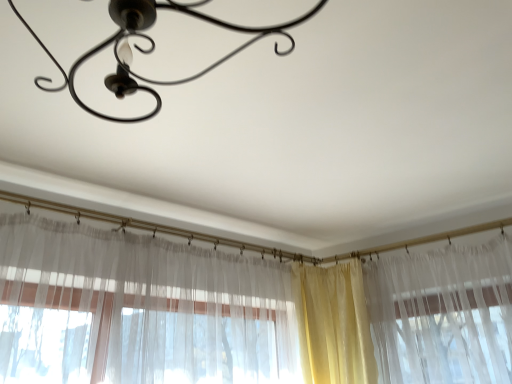
Question: Does metallic chandelier at upper center come in front of yellow sheer curtain at center?

Choices:
 (A) no
 (B) yes

Answer: (B)

Question: Is the position of metallic chandelier at upper center more distant than that of yellow sheer curtain at center?

Choices:
 (A) yes
 (B) no

Answer: (B)

Question: Does metallic chandelier at upper center have a lesser width compared to yellow sheer curtain at center?

Choices:
 (A) yes
 (B) no

Answer: (B)

Question: Can you confirm if metallic chandelier at upper center is shorter than yellow sheer curtain at center?

Choices:
 (A) yes
 (B) no

Answer: (A)

Question: Could yellow sheer curtain at center be considered to be inside metallic chandelier at upper center?

Choices:
 (A) no
 (B) yes

Answer: (A)

Question: From a real-world perspective, is metallic chandelier at upper center positioned over yellow sheer curtain at center based on gravity?

Choices:
 (A) no
 (B) yes

Answer: (B)

Question: Does yellow sheer curtain at center appear on the right side of metallic chandelier at upper center?

Choices:
 (A) yes
 (B) no

Answer: (A)

Question: Can you confirm if yellow sheer curtain at center is bigger than metallic chandelier at upper center?

Choices:
 (A) no
 (B) yes

Answer: (A)

Question: Is yellow sheer curtain at center closer to camera compared to metallic chandelier at upper center?

Choices:
 (A) yes
 (B) no

Answer: (B)

Question: Does yellow sheer curtain at center come behind metallic chandelier at upper center?

Choices:
 (A) no
 (B) yes

Answer: (B)

Question: From the image's perspective, is yellow sheer curtain at center on metallic chandelier at upper center?

Choices:
 (A) yes
 (B) no

Answer: (B)

Question: Is yellow sheer curtain at center facing towards metallic chandelier at upper center?

Choices:
 (A) no
 (B) yes

Answer: (B)

Question: Which is correct: yellow sheer curtain at center is inside metallic chandelier at upper center, or outside of it?

Choices:
 (A) outside
 (B) inside

Answer: (A)